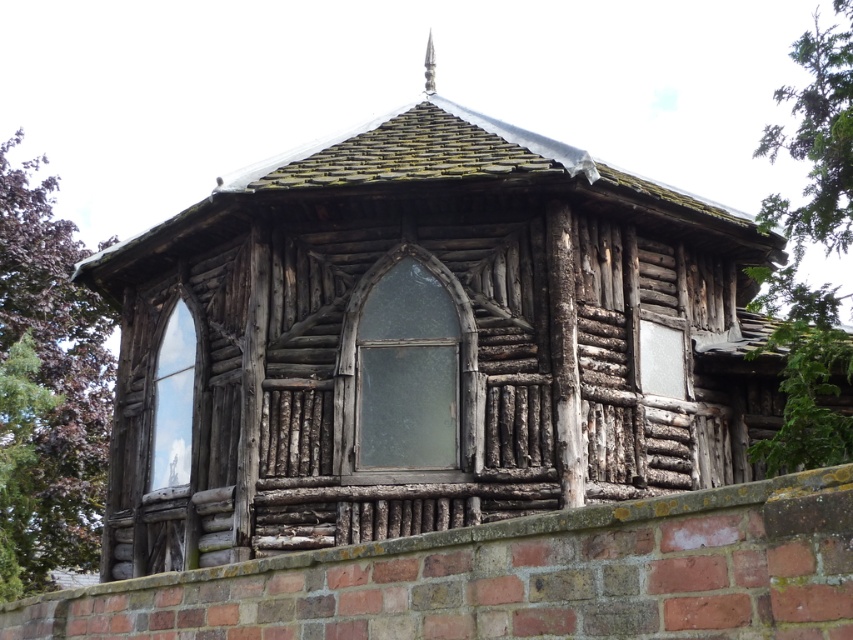
Measure the distance between point (808,220) and camera.

Point (808,220) and camera are 9.26 meters apart from each other.

Between green leafy tree at upper right and translucent glass window at center, which one is positioned lower?

Positioned lower is translucent glass window at center.

You are a GUI agent. You are given a task and a screenshot of the screen. Output one action in this format:
    pyautogui.click(x=<x>, y=<y>)
    Task: Click on the green leafy tree at upper right
    
    Given the screenshot: What is the action you would take?
    pyautogui.click(x=804, y=252)

In the scene shown: Can you confirm if purple leafy tree at left is shorter than green leafy tree at upper right?

Correct, purple leafy tree at left is not as tall as green leafy tree at upper right.

Does purple leafy tree at left appear over green leafy tree at upper right?

No, purple leafy tree at left is not above green leafy tree at upper right.

Between point (21, 385) and point (811, 435), which one is positioned in front?

Positioned in front is point (811, 435).

Locate an element on the screen. purple leafy tree at left is located at coordinates (47, 388).

Does translucent glass window at center appear on the left side of clear glass window at left?

No, translucent glass window at center is not to the left of clear glass window at left.

Is point (341, 376) closer to camera compared to point (173, 467)?

Yes, point (341, 376) is closer to viewer.

Locate an element on the screen. The width and height of the screenshot is (853, 640). translucent glass window at center is located at coordinates (407, 369).